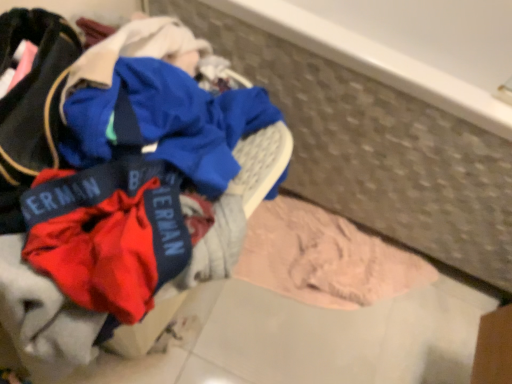
Measure the distance between pink soft fabric at lower right and camera.

pink soft fabric at lower right is 1.16 meters from camera.

In order to face pink soft fabric at lower right, should I rotate leftwards or rightwards?

A 12.100 degree turn to the right will do.

What is the approximate width of pink soft fabric at lower right?

The width of pink soft fabric at lower right is 12.80 inches.

Where is `pink soft fabric at lower right`? The height and width of the screenshot is (384, 512). pink soft fabric at lower right is located at coordinates (324, 258).

Describe the element at coordinates (324, 258) in the screenshot. Image resolution: width=512 pixels, height=384 pixels. I see `pink soft fabric at lower right` at that location.

What do you see at coordinates (136, 192) in the screenshot? I see `red fabric laundry at center` at bounding box center [136, 192].

The height and width of the screenshot is (384, 512). Identify the location of red fabric laundry at center. (136, 192).

Identify the location of pink soft fabric at lower right. The height and width of the screenshot is (384, 512). (324, 258).

Is red fabric laundry at center to the left of pink soft fabric at lower right from the viewer's perspective?

Yes.

Is red fabric laundry at center in front of or behind pink soft fabric at lower right in the image?

red fabric laundry at center is in front of pink soft fabric at lower right.

Which is in front, point (123, 317) or point (254, 226)?

The point (123, 317) is in front.

From the image's perspective, is red fabric laundry at center located above pink soft fabric at lower right?

Yes, from the image's perspective, red fabric laundry at center is over pink soft fabric at lower right.

Based on the photo, from a real-world perspective, between red fabric laundry at center and pink soft fabric at lower right, who is vertically lower?

In real-world perspective, pink soft fabric at lower right is lower.

Considering the relative sizes of red fabric laundry at center and pink soft fabric at lower right in the image provided, is red fabric laundry at center thinner than pink soft fabric at lower right?

No.

Does red fabric laundry at center have a greater height compared to pink soft fabric at lower right?

Yes.

Considering the relative sizes of red fabric laundry at center and pink soft fabric at lower right in the image provided, is red fabric laundry at center bigger than pink soft fabric at lower right?

Yes, red fabric laundry at center is bigger than pink soft fabric at lower right.

Is pink soft fabric at lower right completely or partially inside red fabric laundry at center?

No, red fabric laundry at center does not contain pink soft fabric at lower right.

Is red fabric laundry at center with pink soft fabric at lower right?

red fabric laundry at center is not next to pink soft fabric at lower right, and they're not touching.

Looking at this image, is pink soft fabric at lower right at the back of red fabric laundry at center?

No, red fabric laundry at center's orientation is not away from pink soft fabric at lower right.

What's the angular difference between red fabric laundry at center and pink soft fabric at lower right's facing directions?

90.3 degrees separate the facing orientations of red fabric laundry at center and pink soft fabric at lower right.

How distant is red fabric laundry at center from pink soft fabric at lower right?

red fabric laundry at center and pink soft fabric at lower right are 27.38 inches apart from each other.

The image size is (512, 384). What are the coordinates of `laundry lying above the pink soft fabric at lower right (from the image's perspective)` in the screenshot? It's located at (136, 192).

Is pink soft fabric at lower right to the left or to the right of red fabric laundry at center in the image?

pink soft fabric at lower right is to the right of red fabric laundry at center.

Consider the image. Does pink soft fabric at lower right lie behind red fabric laundry at center?

Yes, it is behind red fabric laundry at center.

Which point is more forward, (373, 266) or (271, 132)?

The point (271, 132) is closer to the camera.

From the image's perspective, who appears lower, pink soft fabric at lower right or red fabric laundry at center?

pink soft fabric at lower right.

Consider the image. From a real-world perspective, between pink soft fabric at lower right and red fabric laundry at center, who is vertically lower?

pink soft fabric at lower right is physically lower.

Looking at their sizes, would you say pink soft fabric at lower right is wider or thinner than red fabric laundry at center?

In the image, pink soft fabric at lower right appears to be more narrow than red fabric laundry at center.

Between pink soft fabric at lower right and red fabric laundry at center, which one has more height?

red fabric laundry at center.

Does pink soft fabric at lower right have a larger size compared to red fabric laundry at center?

No, pink soft fabric at lower right is not bigger than red fabric laundry at center.

Can we say pink soft fabric at lower right lies outside red fabric laundry at center?

That's correct, pink soft fabric at lower right is outside of red fabric laundry at center.

Can you see pink soft fabric at lower right touching red fabric laundry at center?

They are not placed beside each other.

Is pink soft fabric at lower right facing away from red fabric laundry at center?

pink soft fabric at lower right does not have its back to red fabric laundry at center.

Can you tell me how much pink soft fabric at lower right and red fabric laundry at center differ in facing direction?

The angular difference between pink soft fabric at lower right and red fabric laundry at center is 90.3 degrees.

In the image, there is a pink soft fabric at lower right. At what (x,y) coordinates should I click in order to perform the action: click on laundry above it (from the image's perspective). Please return your answer as a coordinate pair (x, y). The width and height of the screenshot is (512, 384). Looking at the image, I should click on tap(136, 192).

I want to click on laundry lying in front of the pink soft fabric at lower right, so click(x=136, y=192).

The width and height of the screenshot is (512, 384). Find the location of `laundry on the left of pink soft fabric at lower right`. laundry on the left of pink soft fabric at lower right is located at coordinates (136, 192).